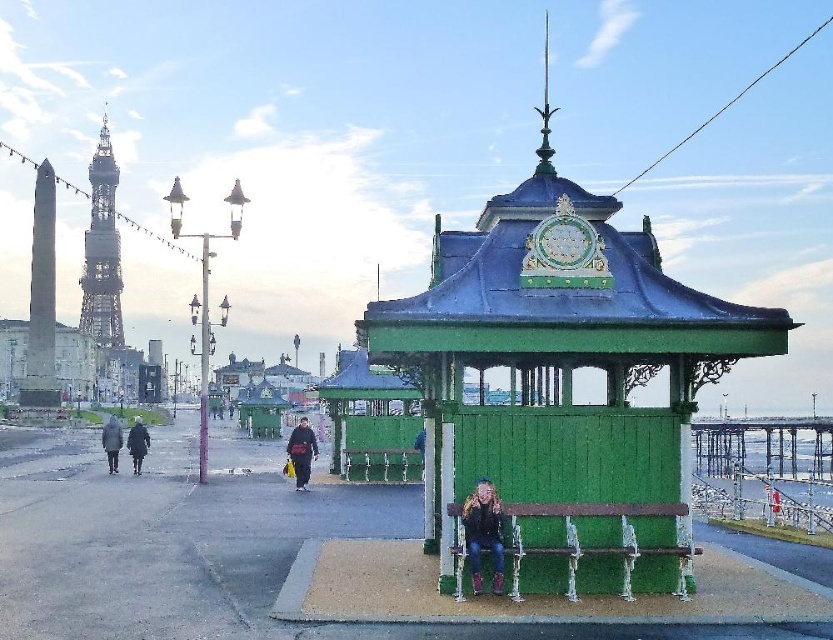
Question: Considering the real-world distances, which object is farthest from the green wooden gazebo at center?

Choices:
 (A) dark gray fabric jacket at center
 (B) green wooden bench at center

Answer: (B)

Question: Is dark gray coat at left further to camera compared to dark gray jacket at left?

Choices:
 (A) yes
 (B) no

Answer: (B)

Question: Which is farther from the denim jacket at lower center?

Choices:
 (A) green wooden bench at center
 (B) dark gray jacket at left
 (C) dark gray wool coat at left

Answer: (A)

Question: Which object appears farthest from the camera in this image?

Choices:
 (A) green wooden bench at center
 (B) dark gray coat at left
 (C) green painted wood clock at center
 (D) green wooden gazebo at center

Answer: (A)

Question: Does black metal tower at upper left have a smaller size compared to green wooden bench at center?

Choices:
 (A) yes
 (B) no

Answer: (B)

Question: Can you confirm if green painted wood clock at center is positioned to the left of green wooden bench at center?

Choices:
 (A) yes
 (B) no

Answer: (B)